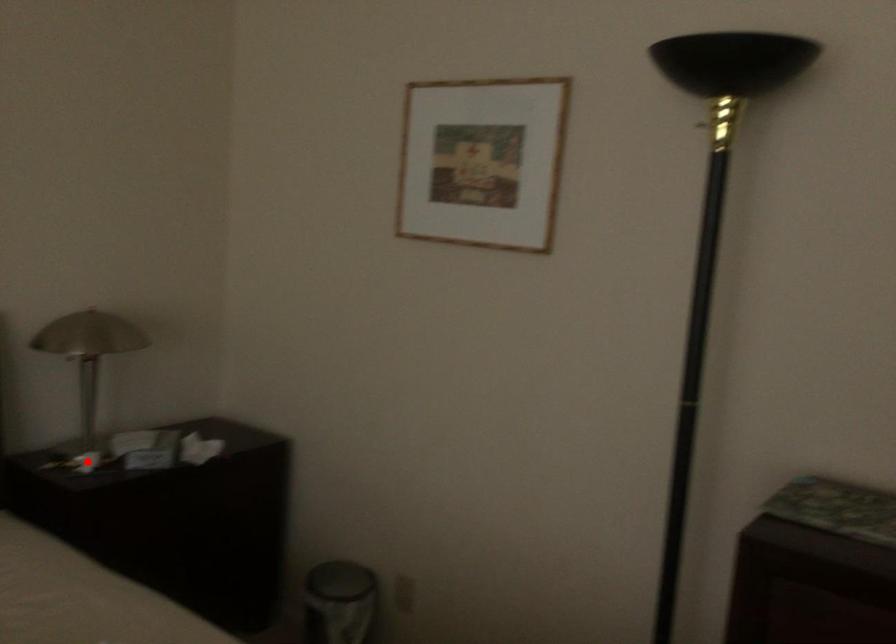
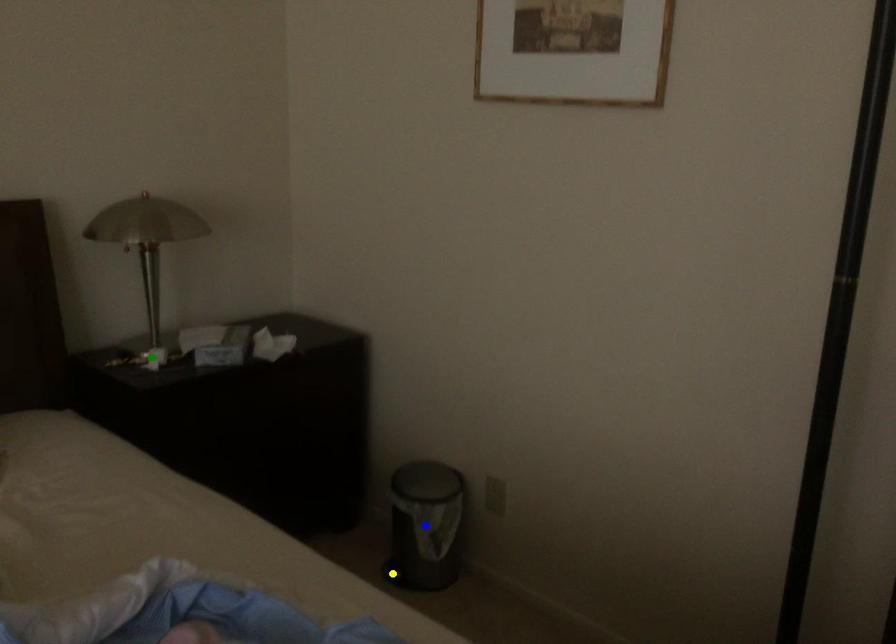
Question: I am providing you with two images of the same scene from different viewpoints. A red point is marked on the first image. You are given multiple points on the second image. Which point in image 2 is actually the same real-world point as the red point in image 1?

Choices:
 (A) yellow point
 (B) green point
 (C) blue point

Answer: (B)